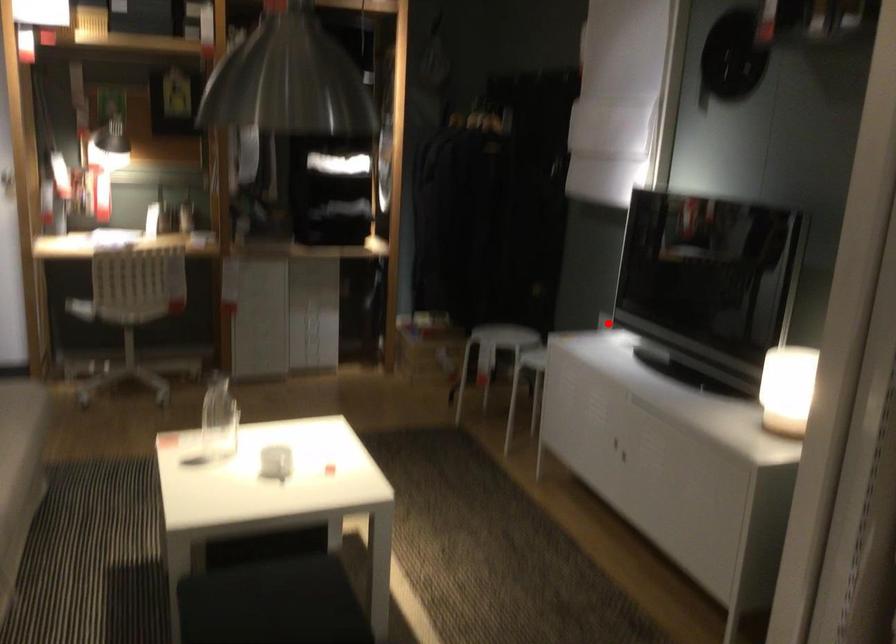
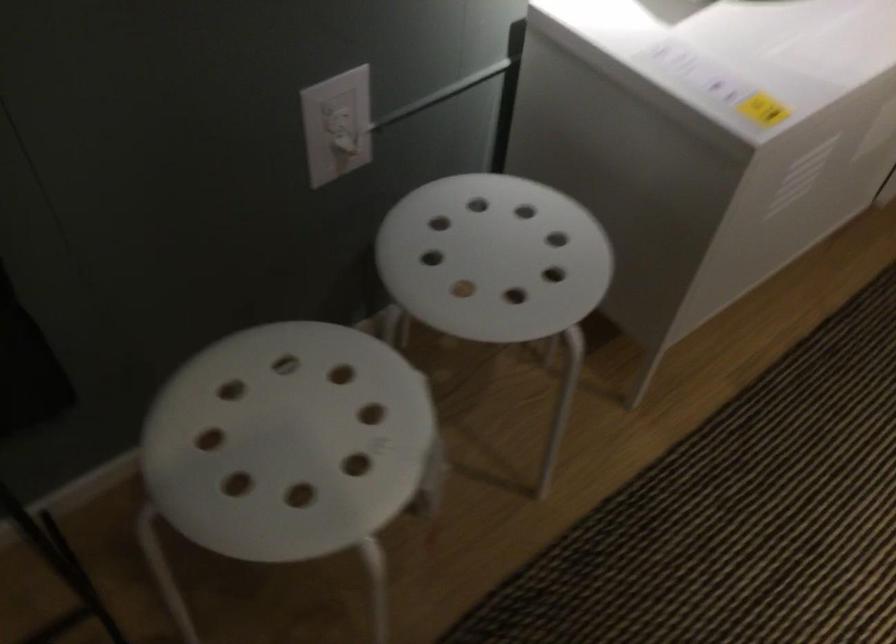
Locate, in the second image, the point that corresponds to the highlighted location in the first image.

(337, 125)